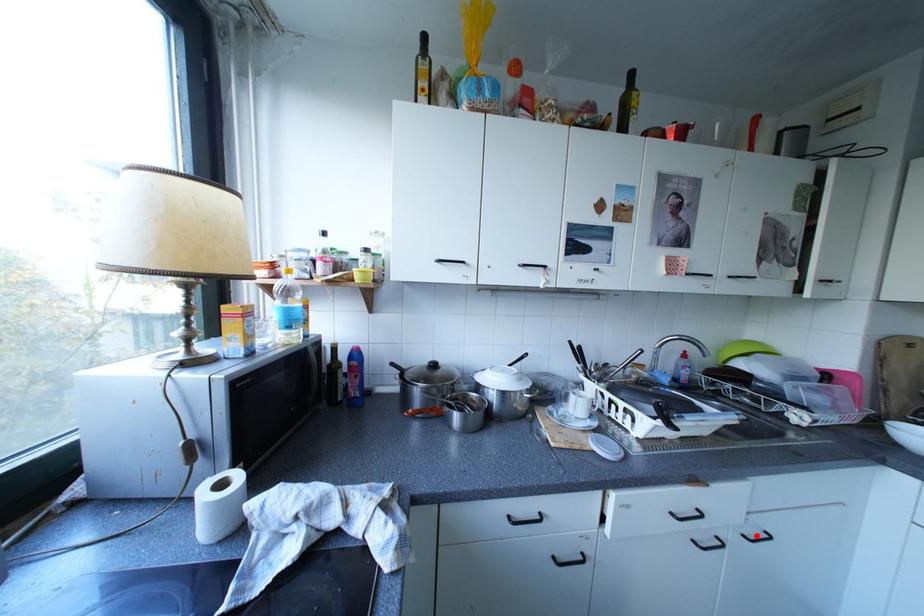
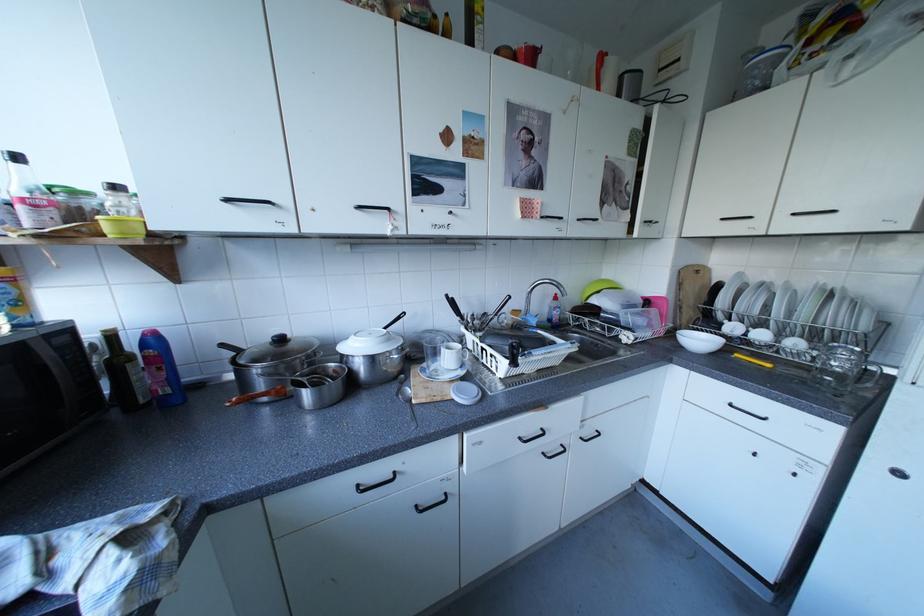
Question: I am providing you with two images of the same scene from different viewpoints. Given a red point in image1, look at the same physical point in image2. Is it:

Choices:
 (A) Closer to the viewpoint
 (B) Farther from the viewpoint

Answer: (B)